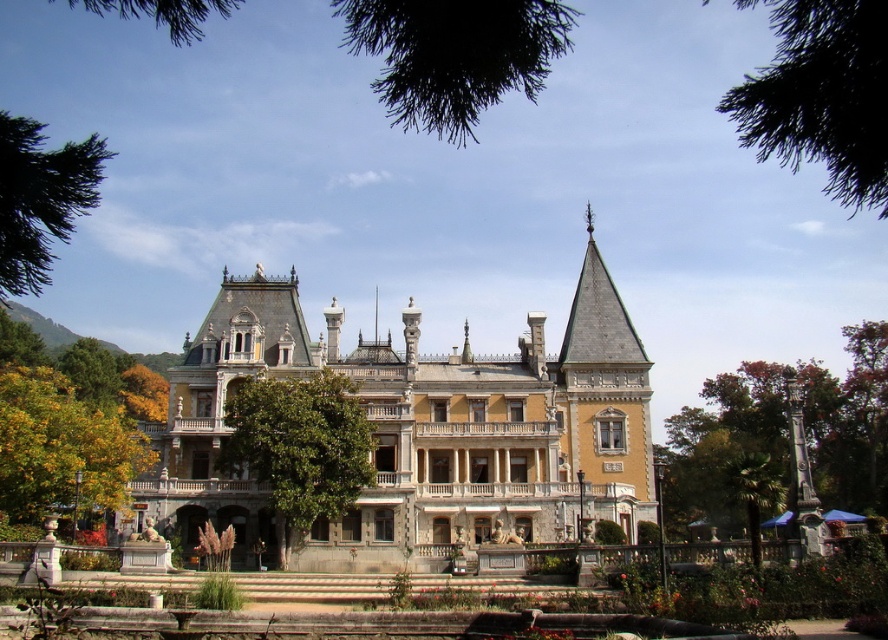
Question: Does stone gray palace at center appear on the right side of green leafy tree at center?

Choices:
 (A) no
 (B) yes

Answer: (B)

Question: Considering the relative positions of green leafy tree at right and green leafy tree at upper left in the image provided, where is green leafy tree at right located with respect to green leafy tree at upper left?

Choices:
 (A) above
 (B) below

Answer: (B)

Question: Which of the following is the farthest from the observer?

Choices:
 (A) (503, 392)
 (B) (22, 189)
 (C) (885, 196)

Answer: (A)

Question: In this image, where is green leafy tree at right located relative to yellow-green leaves at lower left?

Choices:
 (A) above
 (B) below

Answer: (B)

Question: Which point is closer to the camera taking this photo?

Choices:
 (A) (231, 419)
 (B) (74, 141)
 (C) (781, 138)

Answer: (C)

Question: Which object is positioned farthest from the dark green leafy tree at upper right?

Choices:
 (A) yellow-green leaves at lower left
 (B) green leafy tree at upper left
 (C) green leafy tree at center

Answer: (B)